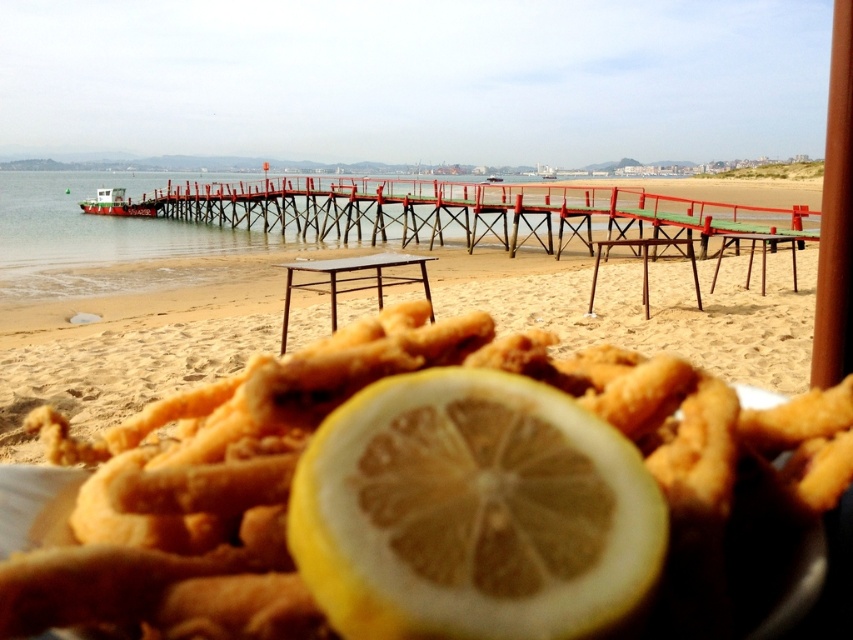
Question: Can you confirm if golden fried calamari at center is positioned to the left of yellow matte lemon at center?

Choices:
 (A) yes
 (B) no

Answer: (A)

Question: Does yellow matte lemon at center have a lesser width compared to sandy yellow at lower center?

Choices:
 (A) yes
 (B) no

Answer: (A)

Question: Among these objects, which one is nearest to the camera?

Choices:
 (A) yellow matte lemon at center
 (B) golden fried calamari at center

Answer: (A)

Question: Which object appears farthest from the camera in this image?

Choices:
 (A) yellow matte lemon at center
 (B) sandy yellow at lower center

Answer: (B)

Question: Which is nearer to the sandy yellow at lower center?

Choices:
 (A) golden fried calamari at center
 (B) yellow matte lemon at center

Answer: (B)

Question: Is golden fried calamari at center smaller than yellow matte lemon at center?

Choices:
 (A) no
 (B) yes

Answer: (A)